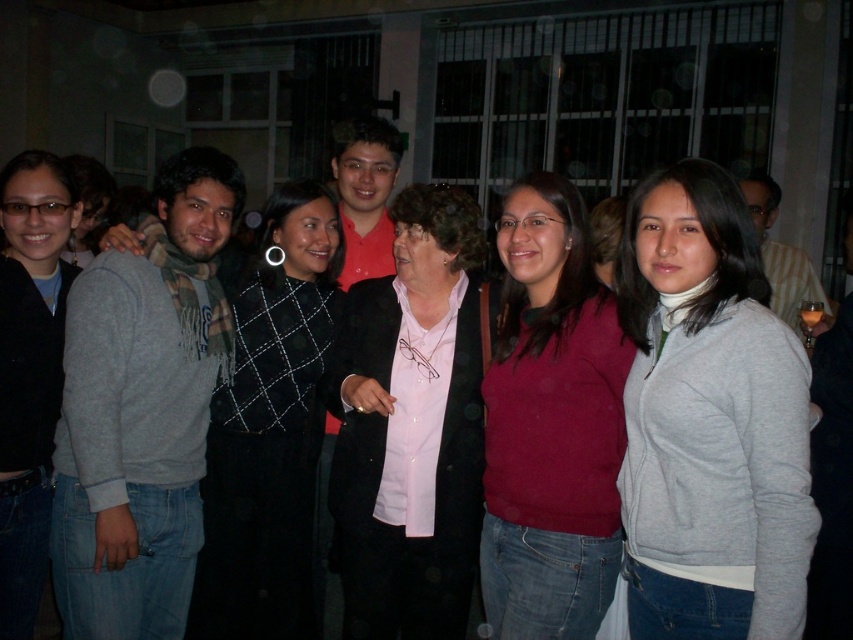
Question: Is gray fleece sweater at left further to camera compared to striped fabric shirt at right?

Choices:
 (A) no
 (B) yes

Answer: (A)

Question: Is the position of gray fleece sweater at left more distant than that of matte red shirt at center?

Choices:
 (A) yes
 (B) no

Answer: (B)

Question: Estimate the real-world distances between objects in this image. Which object is closer to the pink matte shirt at center?

Choices:
 (A) gray fleece sweater at left
 (B) matte red shirt at center
 (C) matte black jacket at left
 (D) gray wool sweater at right

Answer: (A)

Question: Does black diamond-patterned sweater at center appear over striped fabric shirt at right?

Choices:
 (A) yes
 (B) no

Answer: (B)

Question: Which of the following is the farthest from the observer?

Choices:
 (A) (563, 621)
 (B) (35, 154)

Answer: (B)

Question: Among these points, which one is farthest from the camera?

Choices:
 (A) (648, 214)
 (B) (846, 422)
 (C) (137, 572)
 (D) (589, 264)

Answer: (C)